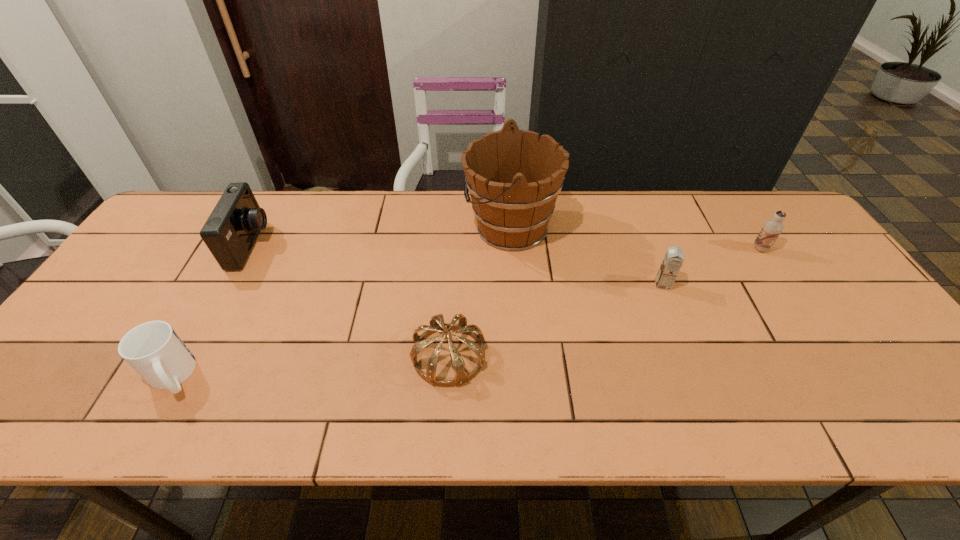
Find the location of `vacant area that lies between the fifth object from left to right and the camera`. vacant area that lies between the fifth object from left to right and the camera is located at coordinates (457, 265).

At what (x,y) coordinates should I click in order to perform the action: click on free spot between the camera and the third nearest object. Please return your answer as a coordinate pair (x, y). Looking at the image, I should click on (457, 265).

This screenshot has width=960, height=540. I want to click on vacant region between the fifth object from left to right and the tiara, so click(556, 320).

The width and height of the screenshot is (960, 540). I want to click on object that is the second nearest to the mug, so [x=437, y=324].

The height and width of the screenshot is (540, 960). In order to click on object that is the fourth closest to the mug in this screenshot , I will do `click(674, 257)`.

This screenshot has width=960, height=540. What are the coordinates of `free point that satisfies the following two spatial constraints: 1. on the back side of the mug; 2. on the right side of the fifth object from left to right` in the screenshot? It's located at (224, 285).

The width and height of the screenshot is (960, 540). Identify the location of vacant space that satisfies the following two spatial constraints: 1. with the handle on the wine bucket; 2. on the front side of the mug. (521, 376).

This screenshot has height=540, width=960. Identify the location of free space in the image that satisfies the following two spatial constraints: 1. with the handle on the tallest object; 2. on the right side of the rightmost object. (512, 249).

I want to click on free space in the image that satisfies the following two spatial constraints: 1. on the front-facing side of the right chocolate milk; 2. on the left side of the camera, so click(x=250, y=249).

The height and width of the screenshot is (540, 960). Identify the location of free location that satisfies the following two spatial constraints: 1. with the handle on the tallest object; 2. on the back side of the right chocolate milk. (512, 249).